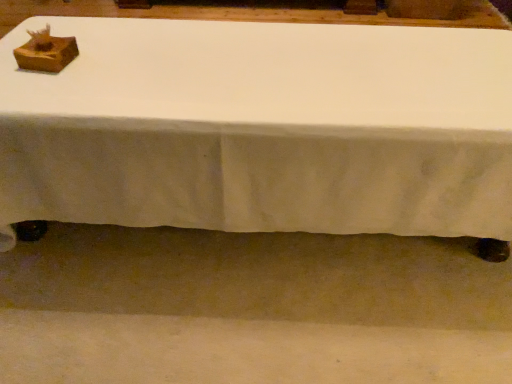
What is the approximate height of white fabric table at center?

The height of white fabric table at center is 3.29 inches.

You are a GUI agent. You are given a task and a screenshot of the screen. Output one action in this format:
    pyautogui.click(x=<x>, y=<y>)
    Task: Click on the white fabric table at center
    The height and width of the screenshot is (384, 512).
    Given the screenshot: What is the action you would take?
    pyautogui.click(x=261, y=129)

What do you see at coordinates (261, 129) in the screenshot? I see `white fabric table at center` at bounding box center [261, 129].

This screenshot has width=512, height=384. Describe the element at coordinates (46, 52) in the screenshot. I see `wooden box at upper left` at that location.

Where is `wooden box at upper left`? Image resolution: width=512 pixels, height=384 pixels. wooden box at upper left is located at coordinates (46, 52).

Where is `white fabric table at center`? white fabric table at center is located at coordinates (261, 129).

Can you confirm if wooden box at upper left is positioned to the right of white fabric table at center?

Incorrect, wooden box at upper left is not on the right side of white fabric table at center.

Which object is closer to the camera taking this photo, wooden box at upper left or white fabric table at center?

white fabric table at center is more forward.

Considering the points (66, 41) and (264, 95), which point is behind, point (66, 41) or point (264, 95)?

The point (66, 41) is farther from the camera.

From the image's perspective, is wooden box at upper left beneath white fabric table at center?

Yes.

From a real-world perspective, is wooden box at upper left physically located above or below white fabric table at center?

wooden box at upper left is above white fabric table at center.

Consider the image. Considering the relative sizes of wooden box at upper left and white fabric table at center in the image provided, is wooden box at upper left wider than white fabric table at center?

No.

Considering the sizes of objects wooden box at upper left and white fabric table at center in the image provided, who is taller, wooden box at upper left or white fabric table at center?

white fabric table at center is taller.

Is wooden box at upper left bigger or smaller than white fabric table at center?

In the image, wooden box at upper left appears to be smaller than white fabric table at center.

Is wooden box at upper left situated inside white fabric table at center or outside?

wooden box at upper left exists outside the volume of white fabric table at center.

Is the surface of wooden box at upper left in direct contact with white fabric table at center?

No, wooden box at upper left is not next to white fabric table at center.

Is wooden box at upper left turned away from white fabric table at center?

That's not correct — wooden box at upper left is not looking away from white fabric table at center.

Where is `table lying on the right of wooden box at upper left`? table lying on the right of wooden box at upper left is located at coordinates 261,129.

Which object is positioned more to the left, white fabric table at center or wooden box at upper left?

wooden box at upper left is more to the left.

Is white fabric table at center behind wooden box at upper left?

No, it is not.

Which is further, (42, 138) or (70, 51)?

The point (70, 51) is more distant.

From the image's perspective, is white fabric table at center above or below wooden box at upper left?

Based on their image positions, white fabric table at center is located above wooden box at upper left.

From a real-world perspective, is white fabric table at center over wooden box at upper left?

No, from a real-world perspective, white fabric table at center is not over wooden box at upper left

Is white fabric table at center thinner than wooden box at upper left?

No, white fabric table at center is not thinner than wooden box at upper left.

Considering the relative sizes of white fabric table at center and wooden box at upper left in the image provided, is white fabric table at center taller than wooden box at upper left?

Correct, white fabric table at center is much taller as wooden box at upper left.

Between white fabric table at center and wooden box at upper left, which one has larger size?

white fabric table at center is bigger.

Is white fabric table at center spatially inside wooden box at upper left, or outside of it?

white fabric table at center lies outside wooden box at upper left.

From the picture: Is white fabric table at center far from wooden box at upper left?

No, white fabric table at center is in close proximity to wooden box at upper left.

Is white fabric table at center oriented towards wooden box at upper left?

No, white fabric table at center is not aimed at wooden box at upper left.

How many degrees apart are the facing directions of white fabric table at center and wooden box at upper left?

There is a 95.7-degree angle between the facing directions of white fabric table at center and wooden box at upper left.

The width and height of the screenshot is (512, 384). In order to click on table that is on the right side of wooden box at upper left in this screenshot , I will do `click(261, 129)`.

Image resolution: width=512 pixels, height=384 pixels. Identify the location of shoe box lying below the white fabric table at center (from the image's perspective). (46, 52).

Identify the location of table below the wooden box at upper left (from a real-world perspective). (261, 129).